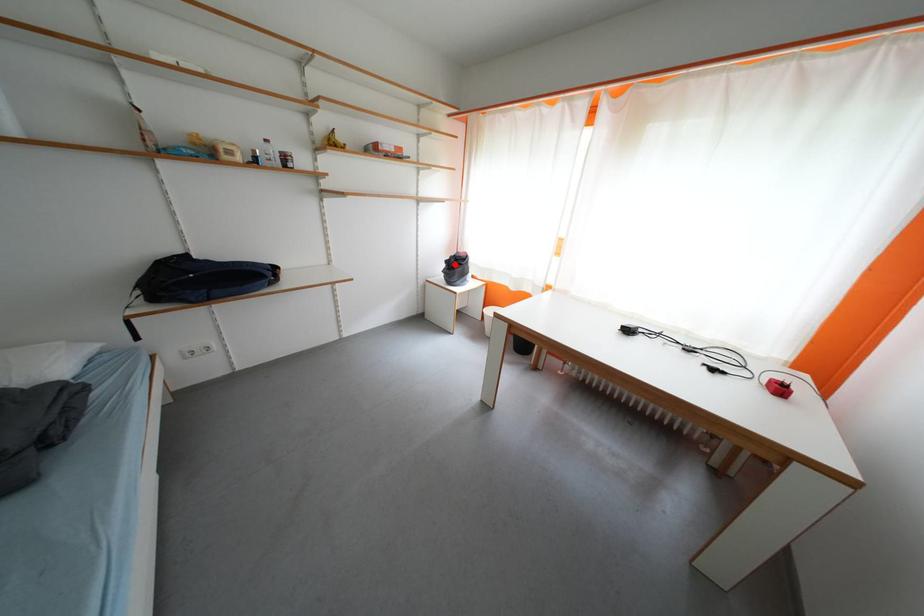
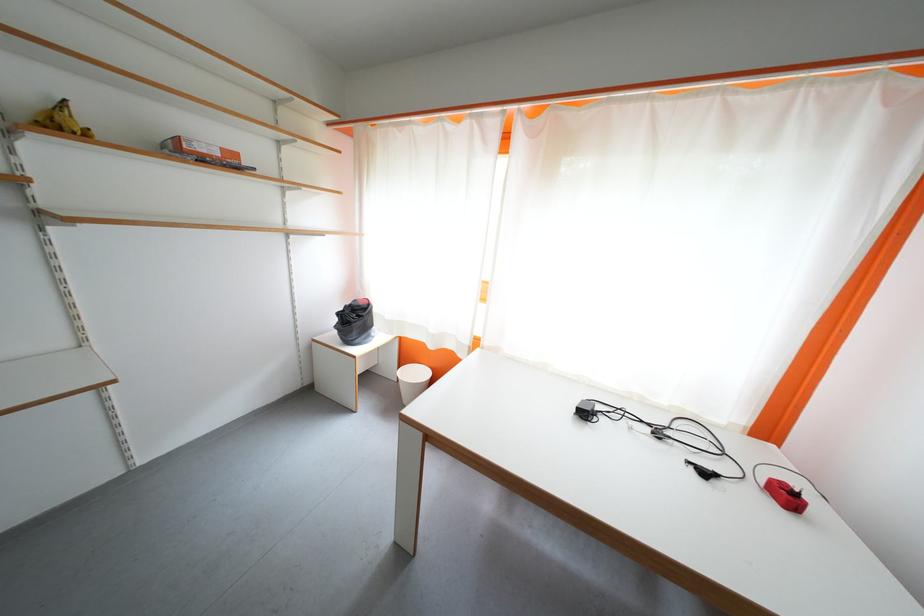
The point at the highlighted location is marked in the first image. Where is the corresponding point in the second image?

(347, 317)